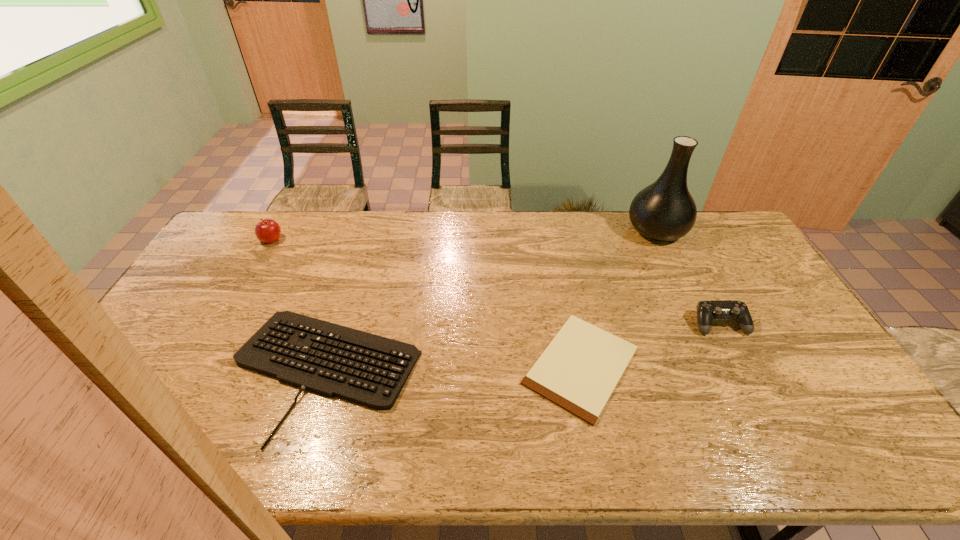
The image size is (960, 540). I want to click on empty space between the fourth tallest object and the second tallest object, so click(x=299, y=306).

Select which object appears as the second closest to the second tallest object. Please provide its 2D coordinates. Your answer should be formatted as a tuple, i.e. [(x, y)], where the tuple contains the x and y coordinates of a point satisfying the conditions above.

[(578, 371)]

Where is `the closest object relative to the computer keyboard`? This screenshot has width=960, height=540. the closest object relative to the computer keyboard is located at coordinates (578, 371).

Image resolution: width=960 pixels, height=540 pixels. Identify the location of vacant area in the image that satisfies the following two spatial constraints: 1. on the back side of the computer keyboard; 2. on the left side of the vase. (368, 231).

You are a GUI agent. You are given a task and a screenshot of the screen. Output one action in this format:
    pyautogui.click(x=<x>, y=<y>)
    Task: Click on the vacant region that satisfies the following two spatial constraints: 1. on the back side of the shortest object; 2. on the right side of the vase
    Image resolution: width=960 pixels, height=540 pixels.
    Given the screenshot: What is the action you would take?
    pyautogui.click(x=554, y=231)

I want to click on vacant space that satisfies the following two spatial constraints: 1. on the front side of the third shortest object; 2. on the left side of the tallest object, so click(702, 323).